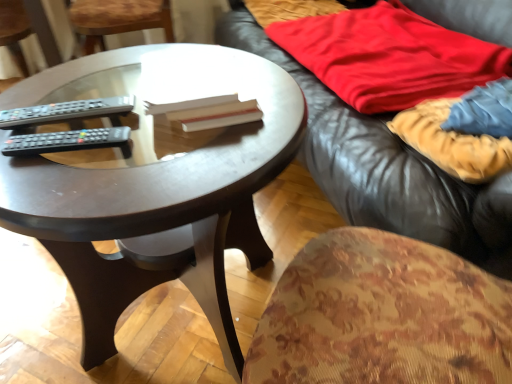
This screenshot has width=512, height=384. Find the location of `free space in front of black plastic remote control at left, which is the 1th remote control in front-to-back order`. free space in front of black plastic remote control at left, which is the 1th remote control in front-to-back order is located at coordinates pos(59,187).